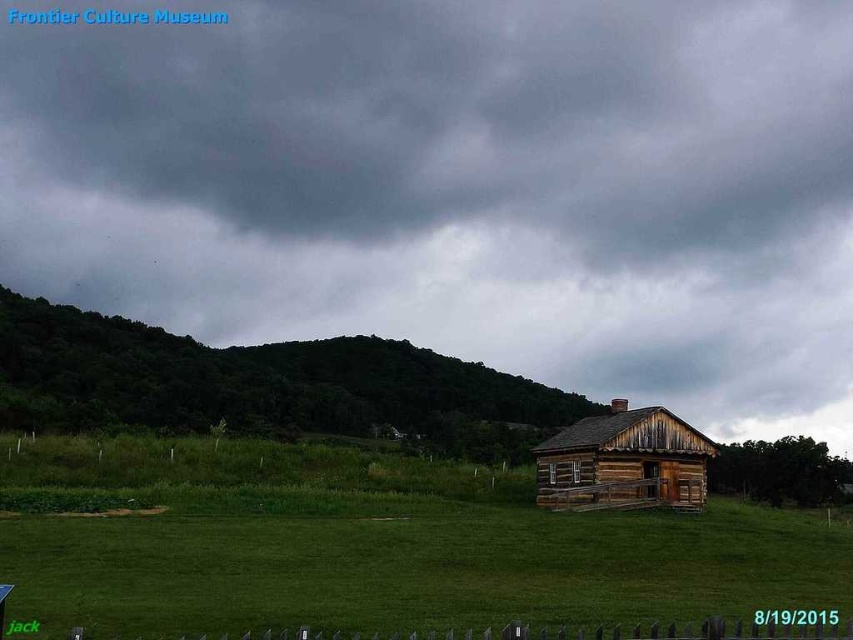
Question: Can you confirm if dark gray cloud at upper center is smaller than weathered wood log cabin at center?

Choices:
 (A) yes
 (B) no

Answer: (B)

Question: Which is farther from the weathered wood log cabin at center?

Choices:
 (A) green leafy hillside at upper left
 (B) dark gray cloud at upper center
 (C) wooden fence at lower center
 (D) green grassy at lower center

Answer: (B)

Question: Where is green grassy at lower center located in relation to weathered wood log cabin at center in the image?

Choices:
 (A) below
 (B) above

Answer: (A)

Question: Estimate the real-world distances between objects in this image. Which object is farther from the wooden fence at lower center?

Choices:
 (A) green leafy hillside at upper left
 (B) dark gray cloud at upper center
 (C) weathered wood log cabin at center
 (D) green grassy at lower center

Answer: (B)

Question: Among these objects, which one is farthest from the camera?

Choices:
 (A) dark gray cloud at upper center
 (B) wooden fence at lower center
 (C) weathered wood log cabin at center
 (D) green grassy at lower center

Answer: (A)

Question: Can you confirm if dark gray cloud at upper center is positioned to the right of green grassy at lower center?

Choices:
 (A) yes
 (B) no

Answer: (B)